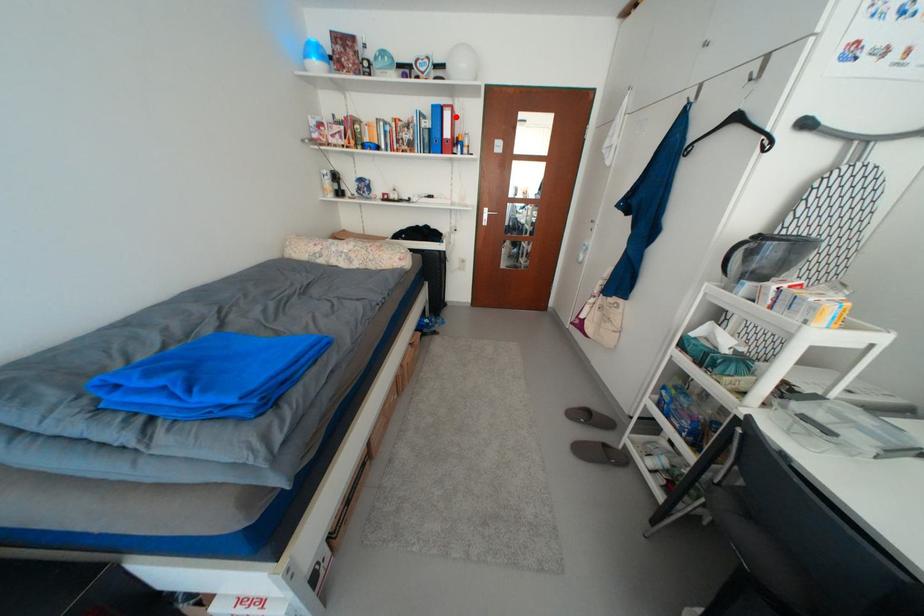
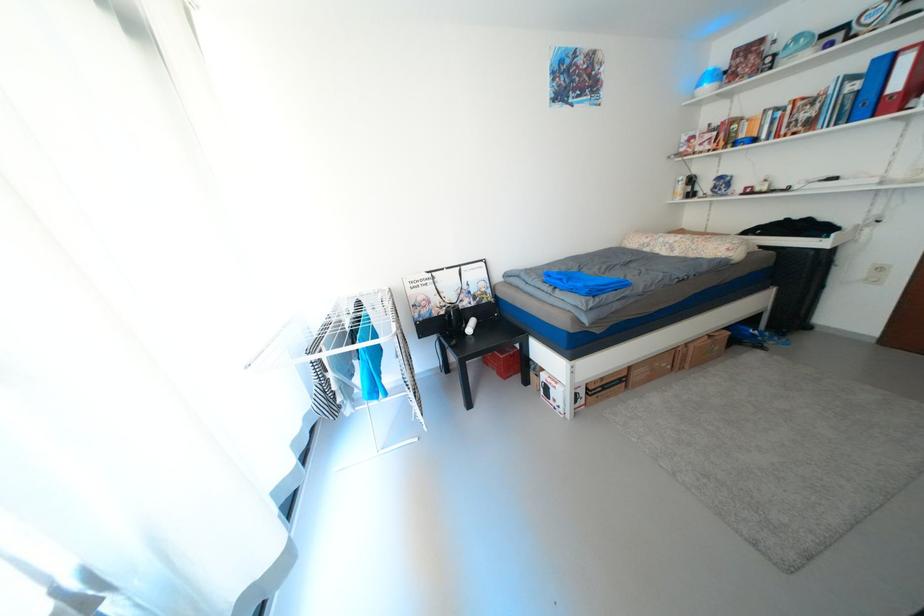
Find the pixel in the second image that matches the highlighted location in the first image.

(916, 62)